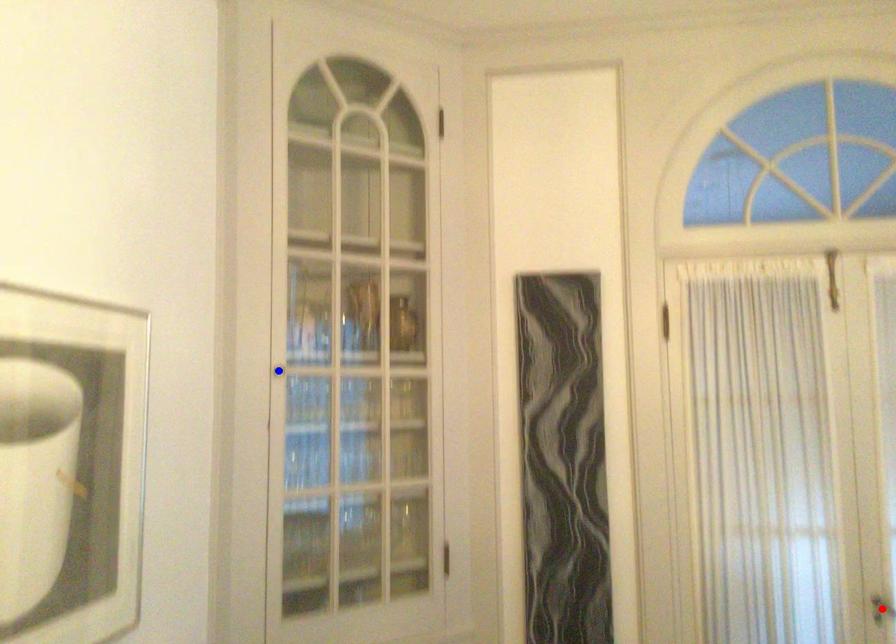
Question: In the image, two points are highlighted. Which point is nearer to the camera? Reply with the corresponding letter.

Choices:
 (A) blue point
 (B) red point

Answer: (A)